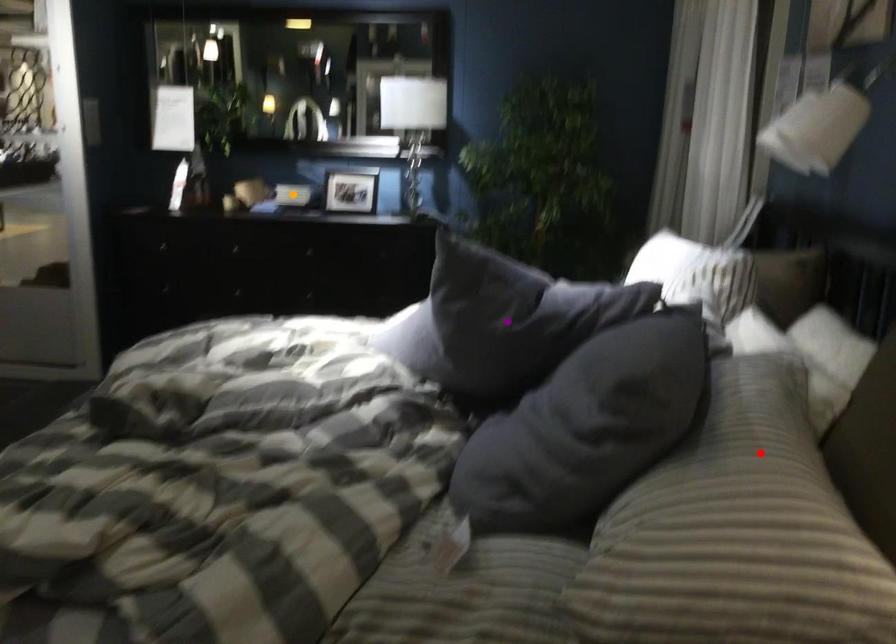
Order these from nearest to farthest:
A) red point
B) orange point
C) purple point

red point, purple point, orange point